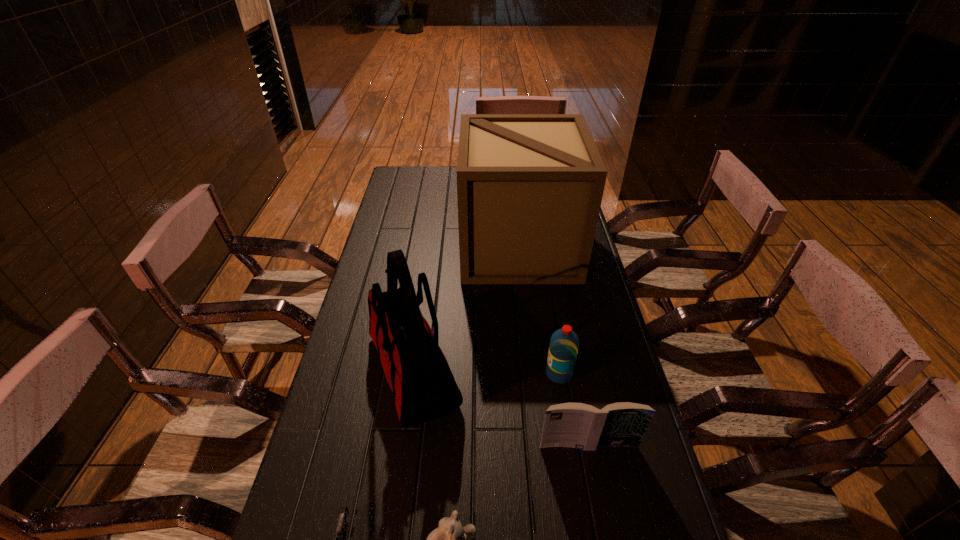
The image size is (960, 540). I want to click on the farthest object, so click(529, 186).

Find the location of a particular element. The image size is (960, 540). duffel bag is located at coordinates (418, 373).

Locate an element on the screen. This screenshot has height=540, width=960. water bottle is located at coordinates (564, 343).

Find the location of a particular element. The height and width of the screenshot is (540, 960). the fourth farthest object is located at coordinates (577, 425).

Where is `free space located on the reinforced sides of the box`? This screenshot has width=960, height=540. free space located on the reinforced sides of the box is located at coordinates (436, 247).

This screenshot has width=960, height=540. I want to click on free space located 0.200m on the reinforced sides of the box, so click(409, 247).

This screenshot has width=960, height=540. What are the coordinates of `blank area located on the reinforced sides of the box` in the screenshot? It's located at (393, 247).

Image resolution: width=960 pixels, height=540 pixels. In order to click on vacant area situated 0.160m on the right of the duffel bag in this screenshot , I will do `click(522, 370)`.

Identify the location of vacant space located on the front label of the water bottle. The width and height of the screenshot is (960, 540). (421, 374).

The image size is (960, 540). I want to click on vacant space located on the front label of the water bottle, so click(436, 374).